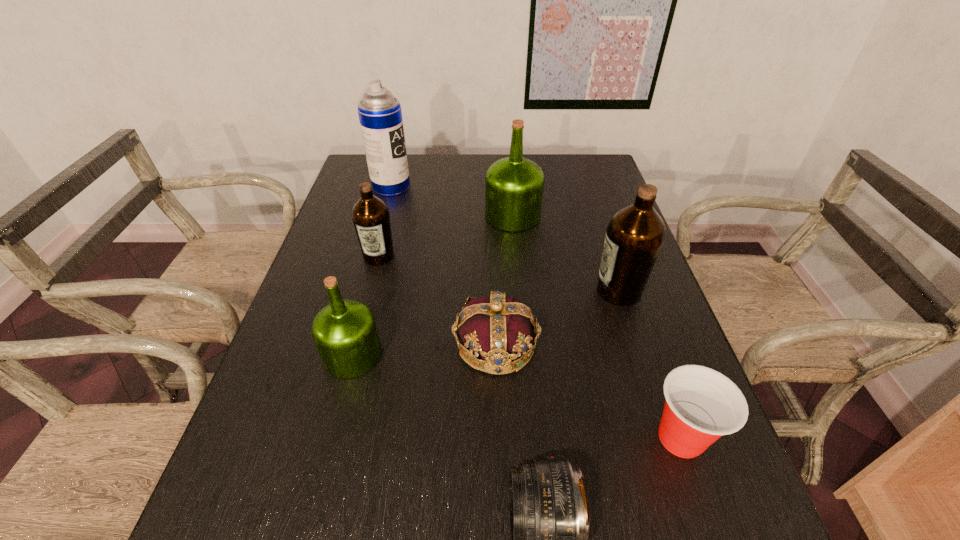
This screenshot has width=960, height=540. I want to click on vacant space at the far right corner of the desktop, so click(x=596, y=165).

You are a GUI agent. You are given a task and a screenshot of the screen. Output one action in this format:
    pyautogui.click(x=<x>, y=<y>)
    Task: Click on the vacant space in between the third olive oil from left to right and the blue aerosol can
    This screenshot has width=960, height=540.
    Given the screenshot: What is the action you would take?
    pyautogui.click(x=452, y=201)

Where is `blank region between the aerosol can and the right green olive oil`? The height and width of the screenshot is (540, 960). blank region between the aerosol can and the right green olive oil is located at coordinates (452, 201).

Find the location of `free space between the purple crown and the nearer brown olive oil`. free space between the purple crown and the nearer brown olive oil is located at coordinates (558, 318).

The width and height of the screenshot is (960, 540). In order to click on vacant space that's between the purple crown and the blue aerosol can in this screenshot , I will do `click(444, 265)`.

Find the location of `free space between the rightmost olive oil and the aerosol can`. free space between the rightmost olive oil and the aerosol can is located at coordinates (505, 239).

Where is `vacant space that's between the red cup and the farther green olive oil`? vacant space that's between the red cup and the farther green olive oil is located at coordinates (597, 327).

I want to click on vacant region between the purple crown and the cup, so click(x=588, y=391).

Where is `empty space that is in between the farthest object and the farthest olive oil`? The height and width of the screenshot is (540, 960). empty space that is in between the farthest object and the farthest olive oil is located at coordinates (452, 201).

The width and height of the screenshot is (960, 540). In order to click on free space between the cup and the crown in this screenshot , I will do `click(588, 391)`.